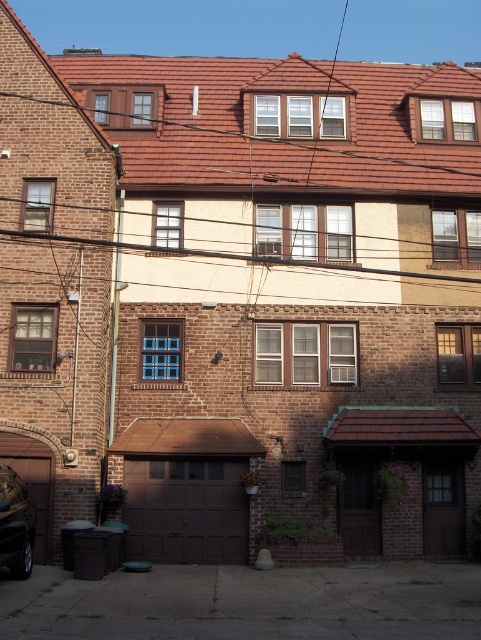
Can you confirm if brown matte garage door at lower center is positioned below shiny black car at lower left?

Yes.

Which is more to the right, brown matte garage door at lower center or shiny black car at lower left?

From the viewer's perspective, brown matte garage door at lower center appears more on the right side.

Is point (205, 490) positioned behind point (14, 490)?

Yes, point (205, 490) is farther from viewer.

Locate an element on the screen. brown matte garage door at lower center is located at coordinates (187, 488).

Who is lower down, brown wood garage door at lower left or shiny black car at lower left?

shiny black car at lower left is lower down.

Is point (45, 557) farther from viewer compared to point (13, 532)?

That is True.

I want to click on brown wood garage door at lower left, so click(34, 483).

Is the position of brown wood garage door at lower center more distant than that of brown matte garage door at lower center?

Yes.

Who is more forward, (418, 468) or (193, 426)?

Point (193, 426) is more forward.

Measure the distance between brown wood garage door at lower center and camera.

A distance of 21.05 meters exists between brown wood garage door at lower center and camera.

Find the location of a particular element. The image size is (481, 640). brown wood garage door at lower center is located at coordinates (402, 477).